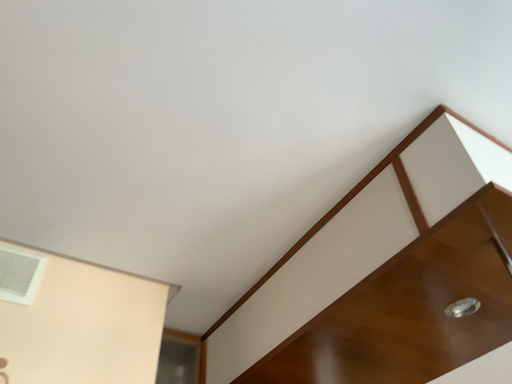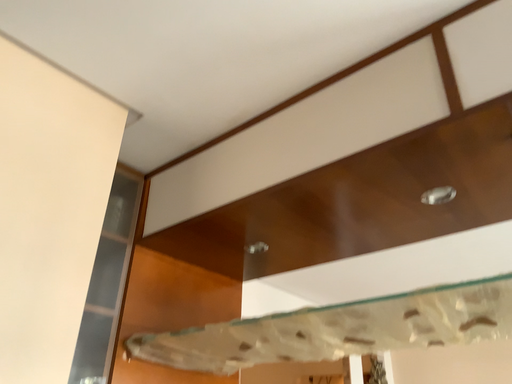
Question: How did the camera likely rotate when shooting the video?

Choices:
 (A) rotated left
 (B) rotated right

Answer: (B)